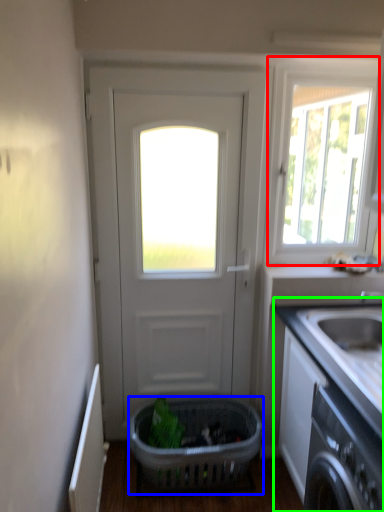
Question: Estimate the real-world distances between objects in this image. Which object is closer to window (highlighted by a red box), basket (highlighted by a blue box) or countertop (highlighted by a green box)?

Choices:
 (A) basket
 (B) countertop

Answer: (B)